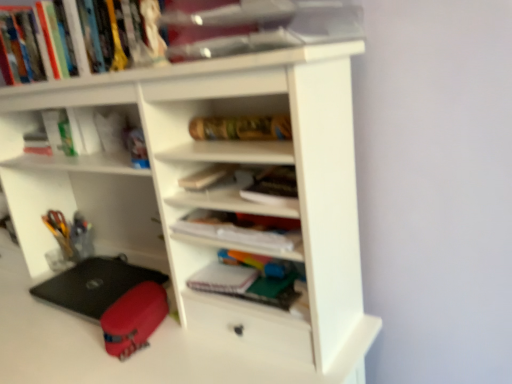
You are a GUI agent. You are given a task and a screenshot of the screen. Output one action in this format:
    pyautogui.click(x=<x>, y=<y>)
    Task: Click on the matte white book at center, the fourth book ordered from the bottom
    The height and width of the screenshot is (384, 512).
    Given the screenshot: What is the action you would take?
    point(206,176)

Measure the distance between wooden textured book at center, placed as the 2th book when sorted from top to bottom, and camera.

The distance of wooden textured book at center, placed as the 2th book when sorted from top to bottom, from camera is 87.50 centimeters.

At what (x,y) coordinates should I click in order to perform the action: click on white paper notebook at center, the 2th book from the bottom. Please return your answer as a coordinate pair (x, y). Looking at the image, I should click on (239, 230).

What do you see at coordinates (134, 319) in the screenshot? The width and height of the screenshot is (512, 384). I see `rubberized red suitcase at lower left` at bounding box center [134, 319].

The width and height of the screenshot is (512, 384). I want to click on hardcover book at center, the third book in the bottom-to-top sequence, so click(273, 187).

Locate an element on the screen. This screenshot has width=512, height=384. matte white book at center, the fourth book ordered from the bottom is located at coordinates (206, 176).

Could you tell me if matte white book at center, the fourth book ordered from the bottom, is turned towards white paper notebook at center, the 2th book from the bottom?

No, matte white book at center, the fourth book ordered from the bottom, is not oriented towards white paper notebook at center, the 2th book from the bottom.

Is matte white book at center, the third book positioned from the top, in contact with white paper notebook at center, the 2th book from the bottom?

They are not placed beside each other.

Can white paper notebook at center, which appears as the 5th book when viewed from the top, be found inside matte white book at center, the third book positioned from the top?

No, white paper notebook at center, which appears as the 5th book when viewed from the top, is located outside of matte white book at center, the third book positioned from the top.

Can you confirm if matte white book at center, the third book positioned from the top, is taller than white paper notebook at center, which appears as the 5th book when viewed from the top?

In fact, matte white book at center, the third book positioned from the top, may be shorter than white paper notebook at center, which appears as the 5th book when viewed from the top.

Based on their positions, is hardcover book at center, which is the fourth book from top to bottom, located to the left or right of wooden textured book at center, which is counted as the fifth book, starting from the bottom?

Clearly, hardcover book at center, which is the fourth book from top to bottom, is on the right of wooden textured book at center, which is counted as the fifth book, starting from the bottom, in the image.

Which object is thinner, hardcover book at center, the third book in the bottom-to-top sequence, or wooden textured book at center, placed as the 2th book when sorted from top to bottom?

wooden textured book at center, placed as the 2th book when sorted from top to bottom, is thinner.

Who is shorter, hardcover book at center, which is the fourth book from top to bottom, or wooden textured book at center, placed as the 2th book when sorted from top to bottom?

With less height is hardcover book at center, which is the fourth book from top to bottom.

Considering their positions, is hardcover book at center, which is the fourth book from top to bottom, located in front of or behind wooden textured book at center, placed as the 2th book when sorted from top to bottom?

Visually, hardcover book at center, which is the fourth book from top to bottom, is located in front of wooden textured book at center, placed as the 2th book when sorted from top to bottom.

Is black matte laptop at lower left inside wooden textured book at center, placed as the 2th book when sorted from top to bottom?

That's incorrect, black matte laptop at lower left is not inside wooden textured book at center, placed as the 2th book when sorted from top to bottom.

Can you tell me how much wooden textured book at center, which is counted as the fifth book, starting from the bottom, and black matte laptop at lower left differ in facing direction?

There is a 3.09-degree angle between the facing directions of wooden textured book at center, which is counted as the fifth book, starting from the bottom, and black matte laptop at lower left.

Does wooden textured book at center, which is counted as the fifth book, starting from the bottom, turn towards black matte laptop at lower left?

No.

From the image's perspective, would you say wooden textured book at center, placed as the 2th book when sorted from top to bottom, is shown under black matte laptop at lower left?

No.

Which object is further away from the camera taking this photo, wooden textured book at center, which is counted as the fifth book, starting from the bottom, or white paper notebook at center, the 2th book from the bottom?

wooden textured book at center, which is counted as the fifth book, starting from the bottom, is further away from the camera.

Visually, is wooden textured book at center, which is counted as the fifth book, starting from the bottom, positioned to the left or to the right of white paper notebook at center, the 2th book from the bottom?

wooden textured book at center, which is counted as the fifth book, starting from the bottom, is to the right of white paper notebook at center, the 2th book from the bottom.

Which of these two, wooden textured book at center, placed as the 2th book when sorted from top to bottom, or white paper notebook at center, which appears as the 5th book when viewed from the top, stands taller?

Standing taller between the two is wooden textured book at center, placed as the 2th book when sorted from top to bottom.

Which object is wider, wooden textured book at center, placed as the 2th book when sorted from top to bottom, or white paper notebook at center, the 2th book from the bottom?

With larger width is white paper notebook at center, the 2th book from the bottom.

What's the angular difference between black matte laptop at lower left and wooden textured book at center, which is counted as the fifth book, starting from the bottom,'s facing directions?

3.09 degrees separate the facing orientations of black matte laptop at lower left and wooden textured book at center, which is counted as the fifth book, starting from the bottom.

From the image's perspective, between black matte laptop at lower left and wooden textured book at center, which is counted as the fifth book, starting from the bottom, which one is located above?

From the image's view, wooden textured book at center, which is counted as the fifth book, starting from the bottom, is above.

Which object is positioned more to the left, black matte laptop at lower left or wooden textured book at center, which is counted as the fifth book, starting from the bottom?

Positioned to the left is black matte laptop at lower left.

From the image's perspective, is rubberized red suitcase at lower left above or below white matte notebook at center, placed as the sixth book when sorted from top to bottom?

rubberized red suitcase at lower left is below white matte notebook at center, placed as the sixth book when sorted from top to bottom.

From a real-world perspective, between rubberized red suitcase at lower left and white matte notebook at center, placed as the sixth book when sorted from top to bottom, who is vertically higher?

In real-world perspective, white matte notebook at center, placed as the sixth book when sorted from top to bottom, is above.

Based on the photo, are rubberized red suitcase at lower left and white matte notebook at center, placed as the sixth book when sorted from top to bottom, far apart?

That's not correct — rubberized red suitcase at lower left is a little close to white matte notebook at center, placed as the sixth book when sorted from top to bottom.

Is hardcover book at upper left, which is the sixth book in bottom-to-top order, looking in the opposite direction of white matte notebook at center, placed as the sixth book when sorted from top to bottom?

No, hardcover book at upper left, which is the sixth book in bottom-to-top order, is not facing the opposite direction of white matte notebook at center, placed as the sixth book when sorted from top to bottom.

From the image's perspective, which one is positioned higher, hardcover book at upper left, which appears as the first book when viewed from the top, or white matte notebook at center, placed as the sixth book when sorted from top to bottom?

From the image's view, hardcover book at upper left, which appears as the first book when viewed from the top, is above.

Considering their positions, is hardcover book at upper left, which appears as the first book when viewed from the top, located in front of or behind white matte notebook at center, the first book ordered from the bottom?

hardcover book at upper left, which appears as the first book when viewed from the top, is in front of white matte notebook at center, the first book ordered from the bottom.

Which book is the 5th one when counting from the back of the white paper notebook at center, the 2th book from the bottom? Please provide its 2D coordinates.

[(206, 176)]

Locate an element on the screen. This screenshot has width=512, height=384. the 1st book located beneath the wooden textured book at center, placed as the 2th book when sorted from top to bottom (from a real-world perspective) is located at coordinates (273, 187).

When comparing their distances from white matte notebook at center, placed as the sixth book when sorted from top to bottom, does hardcover book at center, which is the fourth book from top to bottom, or black matte laptop at lower left seem further?

Among the two, black matte laptop at lower left is located further to white matte notebook at center, placed as the sixth book when sorted from top to bottom.

Which object lies nearer to the anchor point wooden textured book at center, placed as the 2th book when sorted from top to bottom, black matte laptop at lower left or white matte notebook at center, placed as the sixth book when sorted from top to bottom?

Among the two, white matte notebook at center, placed as the sixth book when sorted from top to bottom, is located nearer to wooden textured book at center, placed as the 2th book when sorted from top to bottom.

Based on their spatial positions, is white paper notebook at center, which appears as the 5th book when viewed from the top, or matte white book at center, the fourth book ordered from the bottom, further from hardcover book at upper left, which is the sixth book in bottom-to-top order?

Among the two, white paper notebook at center, which appears as the 5th book when viewed from the top, is located further to hardcover book at upper left, which is the sixth book in bottom-to-top order.

Based on their spatial positions, is hardcover book at upper left, which is the sixth book in bottom-to-top order, or wooden textured book at center, which is counted as the fifth book, starting from the bottom, further from white matte notebook at center, the first book ordered from the bottom?

Among the two, hardcover book at upper left, which is the sixth book in bottom-to-top order, is located further to white matte notebook at center, the first book ordered from the bottom.

Based on their spatial positions, is white matte notebook at center, placed as the sixth book when sorted from top to bottom, or matte white book at center, the fourth book ordered from the bottom, closer to white paper notebook at center, which appears as the 5th book when viewed from the top?

matte white book at center, the fourth book ordered from the bottom, is closer to white paper notebook at center, which appears as the 5th book when viewed from the top.

Looking at this image, from the image, which object appears to be farther from wooden textured book at center, which is counted as the fifth book, starting from the bottom, rubberized red suitcase at lower left or white matte notebook at center, the first book ordered from the bottom?

Among the two, rubberized red suitcase at lower left is located further to wooden textured book at center, which is counted as the fifth book, starting from the bottom.

From the image, which object appears to be nearer to hardcover book at center, which is the fourth book from top to bottom, white paper notebook at center, which appears as the 5th book when viewed from the top, or white matte notebook at center, placed as the sixth book when sorted from top to bottom?

Based on the image, white paper notebook at center, which appears as the 5th book when viewed from the top, appears to be nearer to hardcover book at center, which is the fourth book from top to bottom.

From the image, which object appears to be farther from rubberized red suitcase at lower left, hardcover book at upper left, which appears as the first book when viewed from the top, or hardcover book at center, which is the fourth book from top to bottom?

A: hardcover book at upper left, which appears as the first book when viewed from the top, is further to rubberized red suitcase at lower left.

At what (x,y) coordinates should I click in order to perform the action: click on luggage located between black matte laptop at lower left and white paper notebook at center, the 2th book from the bottom, in the left-right direction. Please return your answer as a coordinate pair (x, y). The image size is (512, 384). Looking at the image, I should click on (134, 319).

Where is `laptop between matte white book at center, the third book positioned from the top, and rubberized red suitcase at lower left vertically`? This screenshot has width=512, height=384. laptop between matte white book at center, the third book positioned from the top, and rubberized red suitcase at lower left vertically is located at coordinates (94, 285).

Locate an element on the screen. The height and width of the screenshot is (384, 512). luggage situated between black matte laptop at lower left and hardcover book at center, the third book in the bottom-to-top sequence, from left to right is located at coordinates (x=134, y=319).

The width and height of the screenshot is (512, 384). What are the coordinates of `laptop between hardcover book at upper left, which appears as the first book when viewed from the top, and rubberized red suitcase at lower left vertically` in the screenshot? It's located at (94, 285).